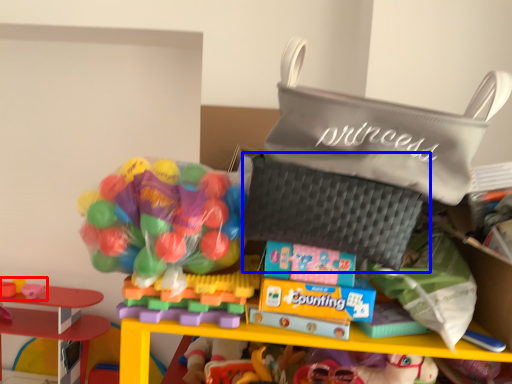
Question: Which of the following is the closest to the observer, toy (highlighted by a red box) or pouch (highlighted by a blue box)?

Choices:
 (A) toy
 (B) pouch

Answer: (B)